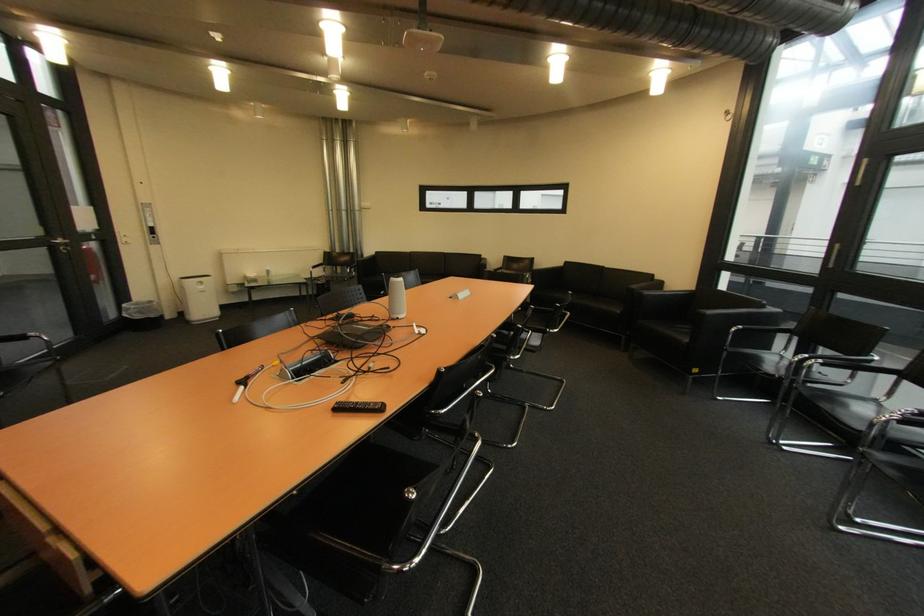
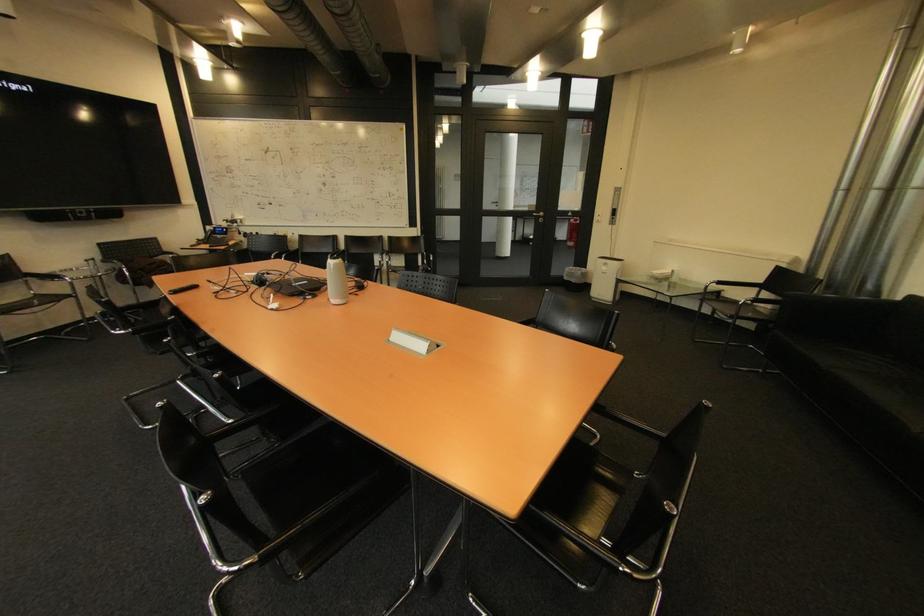
Where in the second image is the point corresponding to (147,318) from the first image?

(574, 280)